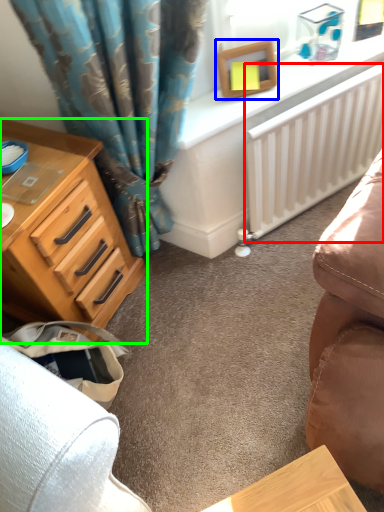
Question: Which object is positioned closest to radiator (highlighted by a red box)? Select from picture frame (highlighted by a blue box) and chest of drawers (highlighted by a green box).

Choices:
 (A) picture frame
 (B) chest of drawers

Answer: (A)